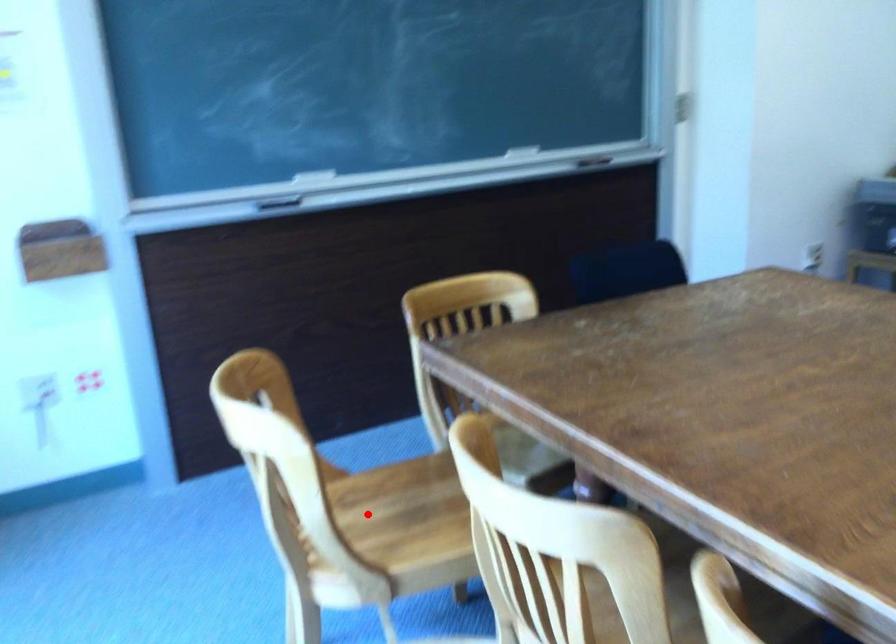
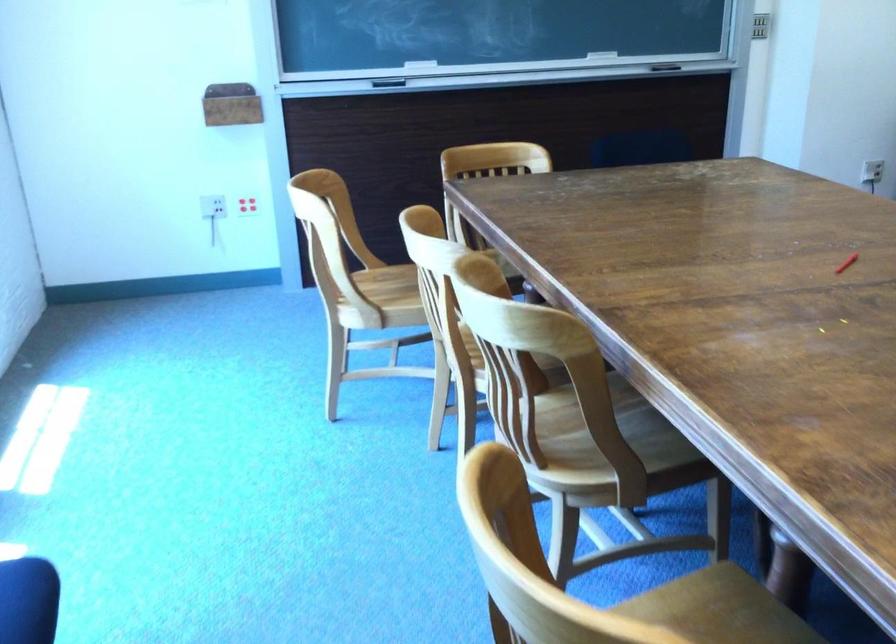
Question: I am providing you with two images of the same scene from different viewpoints. Given a red point in image1, look at the same physical point in image2. Is it:

Choices:
 (A) Closer to the viewpoint
 (B) Farther from the viewpoint

Answer: (B)